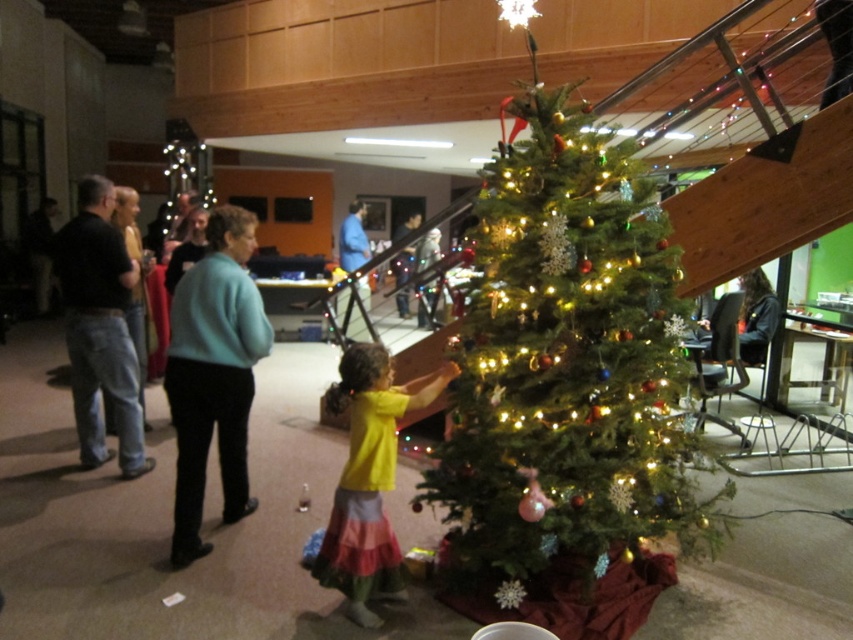
Question: Can you confirm if jeans at left is thinner than light blue sweater at left?

Choices:
 (A) yes
 (B) no

Answer: (A)

Question: Among these objects, which one is farthest from the camera?

Choices:
 (A) teal sweater at center
 (B) jeans at left
 (C) yellow matte shirt at center
 (D) green matte christmas tree at center

Answer: (B)

Question: Which of the following is the farthest from the observer?

Choices:
 (A) yellow matte shirt at center
 (B) light blue sweater at left

Answer: (B)

Question: Can you confirm if teal sweater at center is bigger than yellow matte shirt at center?

Choices:
 (A) no
 (B) yes

Answer: (B)

Question: Can you confirm if green matte christmas tree at center is positioned above jeans at left?

Choices:
 (A) yes
 (B) no

Answer: (B)

Question: Which of the following is the closest to the observer?

Choices:
 (A) teal sweater at center
 (B) green matte christmas tree at center
 (C) light blue sweater at left

Answer: (B)